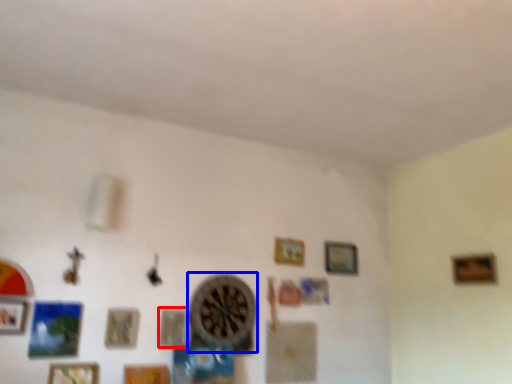
Question: Which object is further to the camera taking this photo, picture frame (highlighted by a red box) or clock (highlighted by a blue box)?

Choices:
 (A) picture frame
 (B) clock

Answer: (B)